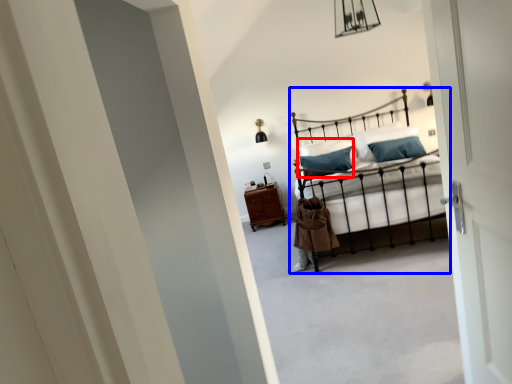
Question: Which point is further to the camera, pillow (highlighted by a red box) or bed (highlighted by a blue box)?

Choices:
 (A) pillow
 (B) bed

Answer: (A)